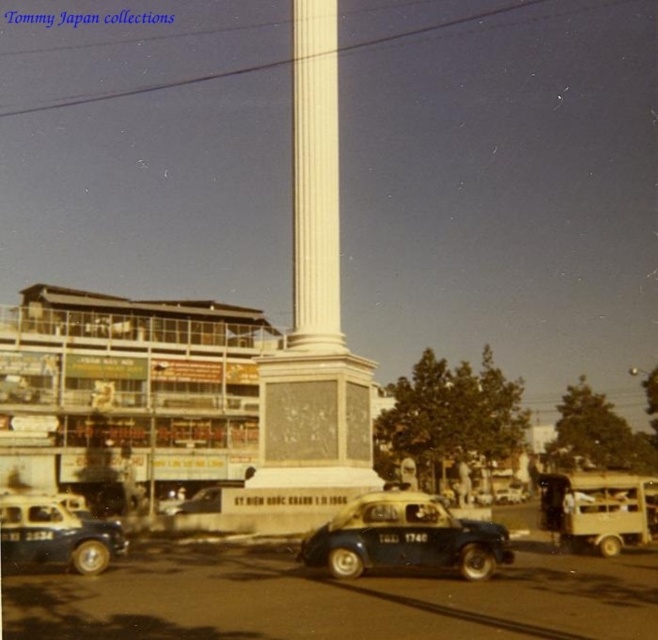
Is blue matte taxi at lower left in front of metallic blue car at center?

Yes, blue matte taxi at lower left is closer to the viewer.

Does blue matte taxi at lower left appear on the left side of metallic blue car at center?

No, blue matte taxi at lower left is not to the left of metallic blue car at center.

What are the coordinates of `blue matte taxi at lower left` in the screenshot? It's located at (55, 534).

Can you confirm if blue matte car at center is thinner than metallic blue car at center?

Yes, blue matte car at center is thinner than metallic blue car at center.

Describe the element at coordinates (405, 538) in the screenshot. I see `blue matte car at center` at that location.

This screenshot has height=640, width=658. Find the location of `blue matte car at center`. blue matte car at center is located at coordinates (405, 538).

Does blue matte car at center have a greater height compared to blue matte taxi at lower left?

No.

Does point (374, 545) come closer to viewer compared to point (118, 547)?

Yes.

Image resolution: width=658 pixels, height=640 pixels. I want to click on blue matte car at center, so coord(405,538).